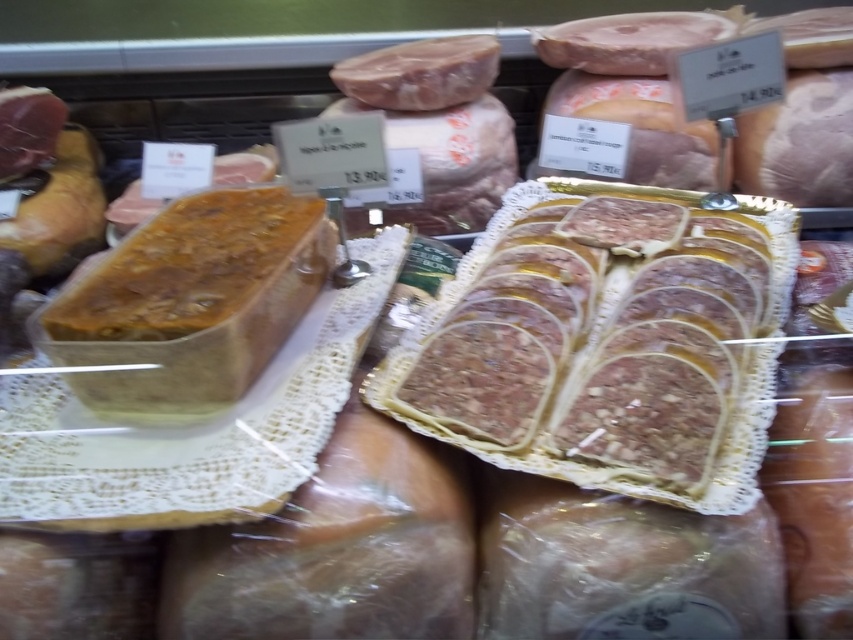
Can you confirm if sliced brown meat at center is shorter than brown crumbly loaf at center?

No.

Who is higher up, sliced brown meat at center or brown crumbly loaf at center?

brown crumbly loaf at center is above.

Does point (519, 445) come farther from viewer compared to point (201, 388)?

Yes, it is.

Where is `sliced brown meat at center`? sliced brown meat at center is located at coordinates (607, 342).